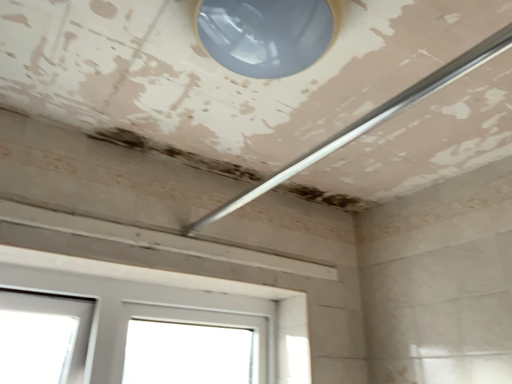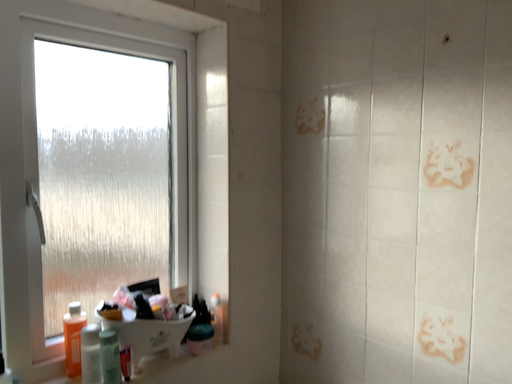
Question: How did the camera likely rotate when shooting the video?

Choices:
 (A) rotated left
 (B) rotated right

Answer: (B)